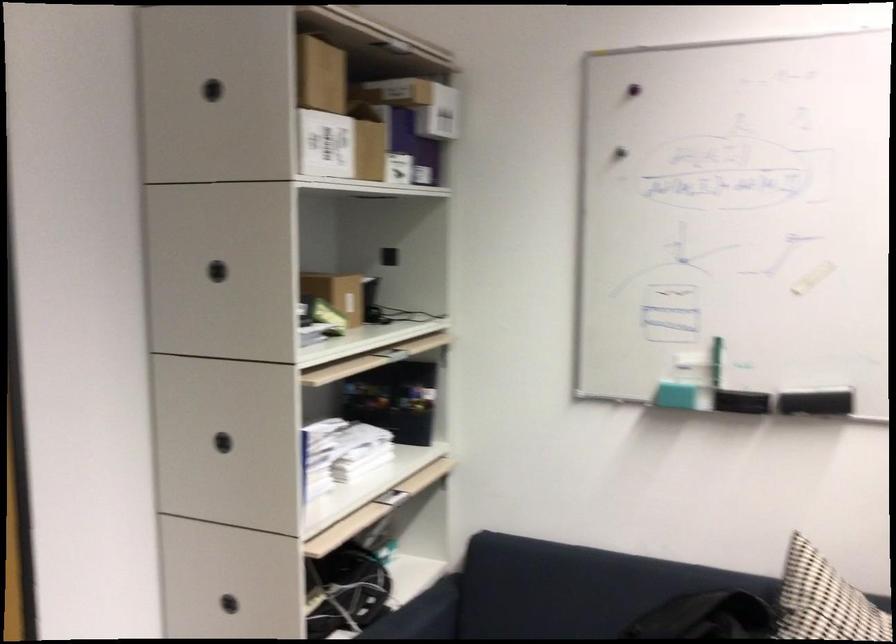
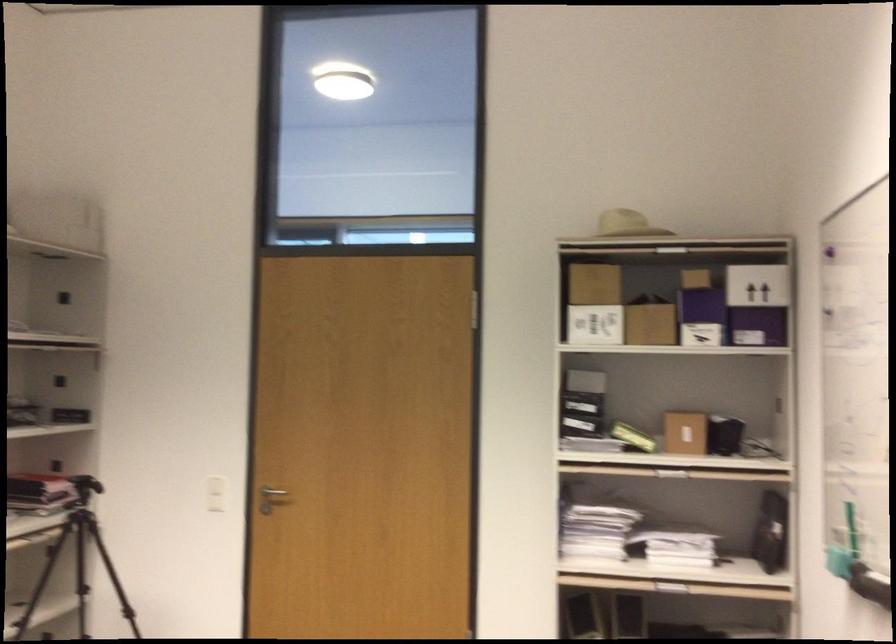
In the second image, find the point that corresponds to (x=315, y=319) in the first image.

(633, 437)